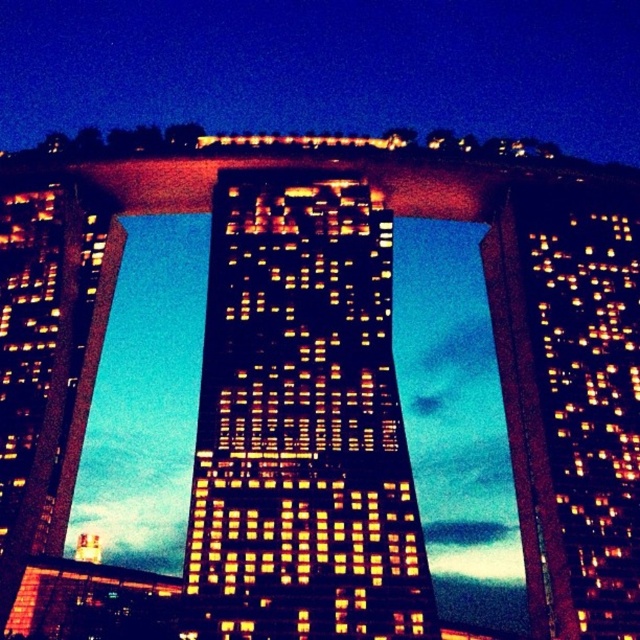
Is matte glass skyscraper at center shorter than matte glass skyscraper at right?

Yes.

Which is behind, point (202, 516) or point (522, 525)?

The point (522, 525) is behind.

Where is `matte glass skyscraper at center`? matte glass skyscraper at center is located at coordinates (301, 422).

Locate an element on the screen. The image size is (640, 640). matte glass skyscraper at center is located at coordinates (301, 422).

Can you confirm if matte glass skyscraper at right is positioned to the left of matte glass tower at left?

No, matte glass skyscraper at right is not to the left of matte glass tower at left.

Between matte glass skyscraper at right and matte glass tower at left, which one is positioned lower?

matte glass skyscraper at right is lower down.

Who is more distant from viewer, (x=620, y=470) or (x=44, y=364)?

Point (x=44, y=364)

Identify the location of matte glass skyscraper at right. (572, 397).

Can you confirm if matte glass skyscraper at center is bigger than matte glass tower at left?

Yes, matte glass skyscraper at center is bigger than matte glass tower at left.

Can you confirm if matte glass skyscraper at center is shorter than matte glass tower at left?

Correct, matte glass skyscraper at center is not as tall as matte glass tower at left.

Locate an element on the screen. matte glass skyscraper at center is located at coordinates (301, 422).